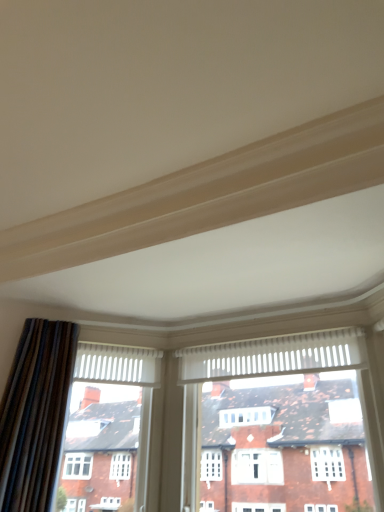
Question: Relative to velvet-like brown curtain at left, is white textured window at center in front or behind?

Choices:
 (A) behind
 (B) front

Answer: (A)

Question: Is white textured window at center to the left or to the right of velvet-like brown curtain at left in the image?

Choices:
 (A) left
 (B) right

Answer: (B)

Question: In terms of size, does white textured window at center appear bigger or smaller than velvet-like brown curtain at left?

Choices:
 (A) big
 (B) small

Answer: (A)

Question: Considering the positions of velvet-like brown curtain at left and white textured window at center in the image, is velvet-like brown curtain at left bigger or smaller than white textured window at center?

Choices:
 (A) small
 (B) big

Answer: (A)

Question: Relative to white textured window at center, is velvet-like brown curtain at left in front or behind?

Choices:
 (A) behind
 (B) front

Answer: (B)

Question: Does point (16, 458) appear closer or farther from the camera than point (350, 478)?

Choices:
 (A) closer
 (B) farther

Answer: (A)

Question: Would you say velvet-like brown curtain at left is to the left or to the right of white textured window at center in the picture?

Choices:
 (A) left
 (B) right

Answer: (A)